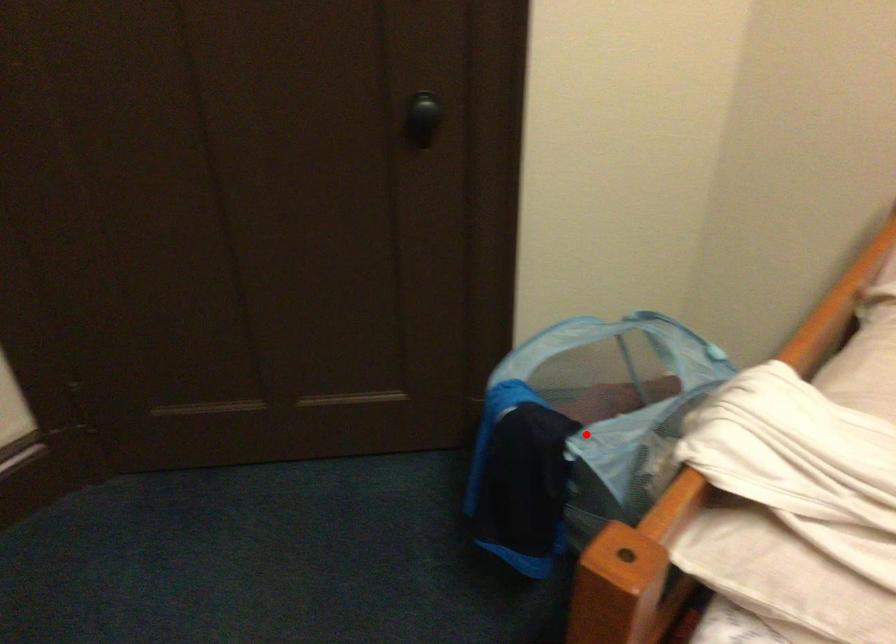
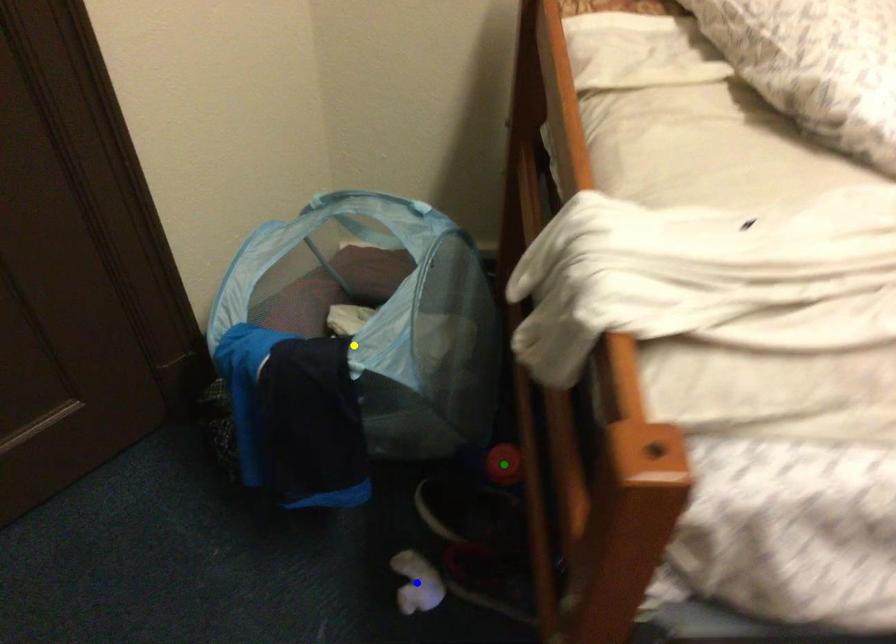
Question: I am providing you with two images of the same scene from different viewpoints. A red point is marked on the first image. You are given multiple points on the second image. In image 2, which mark is for the same physical point as the one in image 1?

Choices:
 (A) green point
 (B) blue point
 (C) yellow point

Answer: (C)